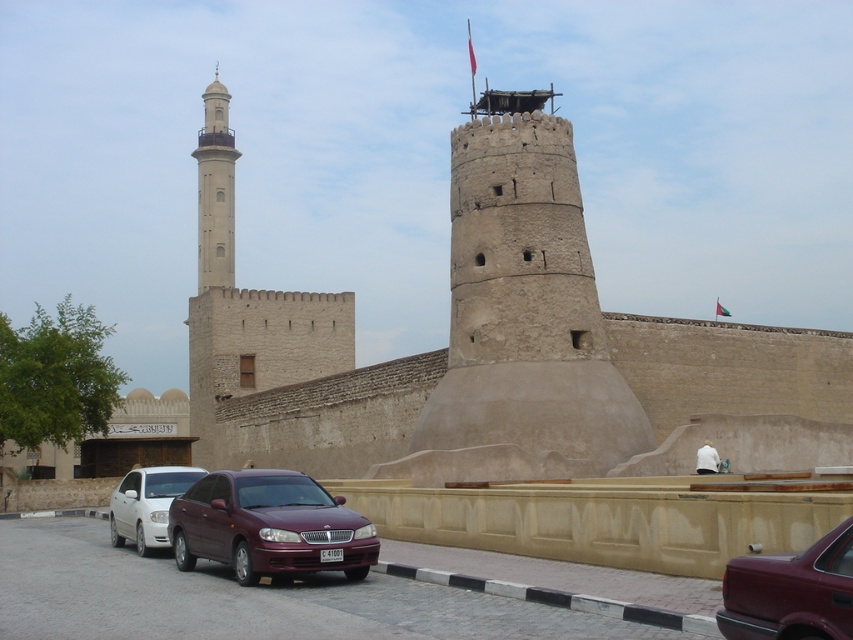
You are a drone operator tasked with capturing aerial footage of the historical fortification. The drone must fly from the center of the image to the light beige stone minaret at upper left. What are the coordinates of the minaret to ensure accurate targeting?

The light beige stone minaret at upper left is located at coordinates point [215,189], so the drone should target that point to accurately reach the minaret.

You are driving a white matte sedan at center and want to park it next to the brown stone fort at center. Given that the fort is wider than the car, can you fit the sedan entirely within the fort?

The brown stone fort at center is wider than the white matte sedan at center, so yes, the sedan can be parked entirely within the fort as it is narrower than the fort.

You are a tour guide explaining the fort to visitors. You mention the light beige stone minaret at upper left and the white matte sedan at center. Which one do you tell them is taller?

The light beige stone minaret at upper left is much taller than the white matte sedan at center.